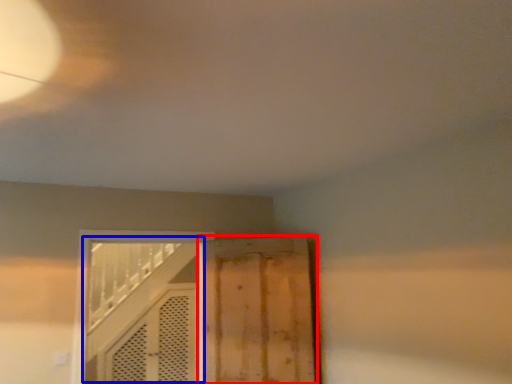
Question: Which of the following is the farthest to the observer, door (highlighted by a red box) or door (highlighted by a blue box)?

Choices:
 (A) door
 (B) door

Answer: (A)